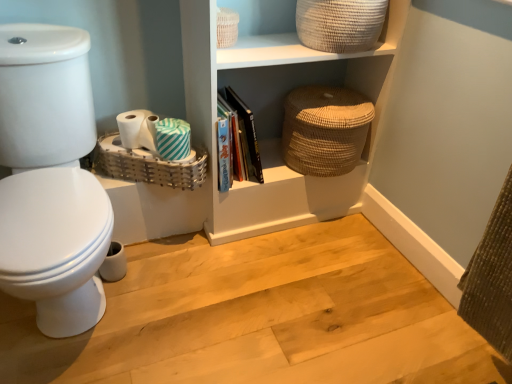
I want to click on vacant area on top of wooden floor at lower left (from a real-world perspective), so click(x=254, y=298).